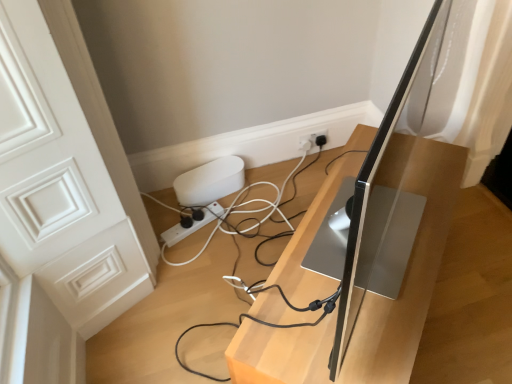
At what (x,y) coordinates should I click in order to perform the action: click on free spot below silver metallic computer monitor at center (from a real-world perspective). Please return your answer as a coordinate pair (x, y). The image size is (512, 384). Looking at the image, I should click on (390, 237).